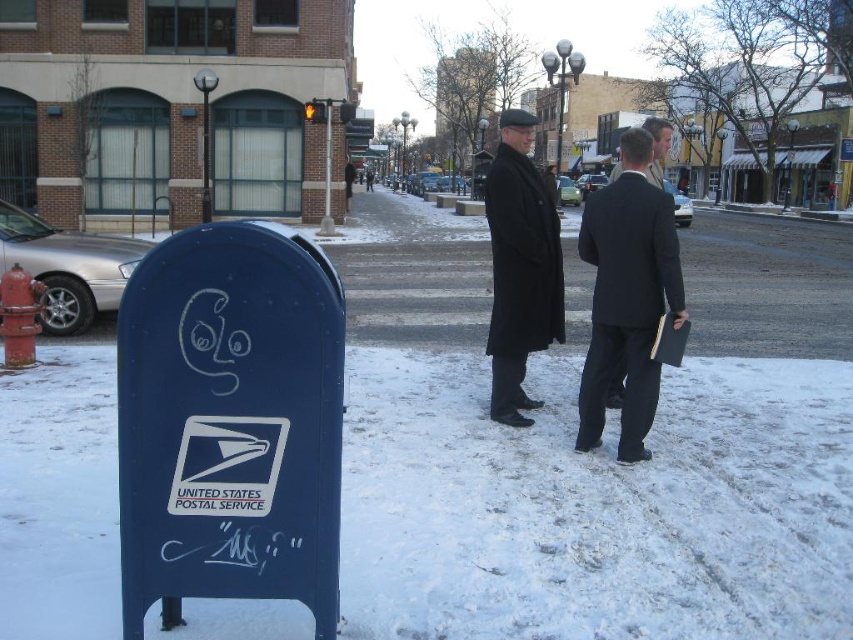
In the scene shown: You are a delivery person trying to place a package between the blue painted metal mailbox at lower left and the black wool coat at center. Can the package fit if it is 1.2 meters wide?

The blue painted metal mailbox at lower left has a lesser width compared to black wool coat at center. Since the mailbox is narrower, the space between them may accommodate the 1.2 meter wide package. However, the exact fit depends on the total available space between the two objects, which isn

You are a photographer standing at the camera position. You want to capture a photo of the black matte suit at center without moving the subject. Can you reach the subject within 16 feet to adjust the lighting? Please answer yes or no.

The black matte suit at center and camera are 15.83 feet apart, so yes, you can reach the subject within 16 feet to adjust the lighting.

You are a photographer trying to capture the two individuals wearing the black matte suit at center and the black wool coat at center. Since you want to focus on their clothing details, which one should you zoom in on to ensure the suit and coat are clearly visible without blurring?

The black matte suit at center is thinner than the black wool coat at center, so you should zoom in on the black wool coat at center to ensure its details are visible without blurring because thicker garments generally require less zoom to capture details clearly.